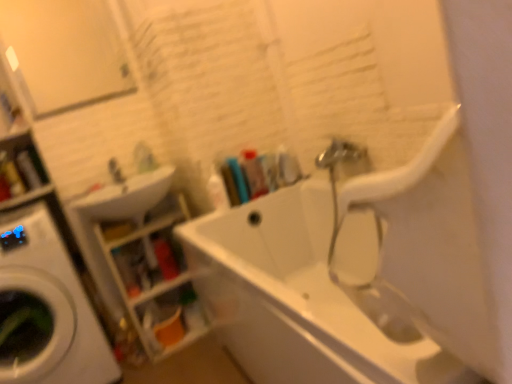
This screenshot has width=512, height=384. In order to click on free location to the right of satin nickel faucet at upper left in this screenshot , I will do `click(145, 178)`.